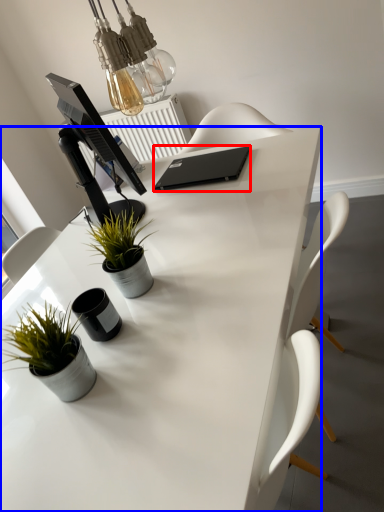
Question: Which of the following is the closest to the observer, laptop (highlighted by a red box) or desk (highlighted by a blue box)?

Choices:
 (A) laptop
 (B) desk

Answer: (B)